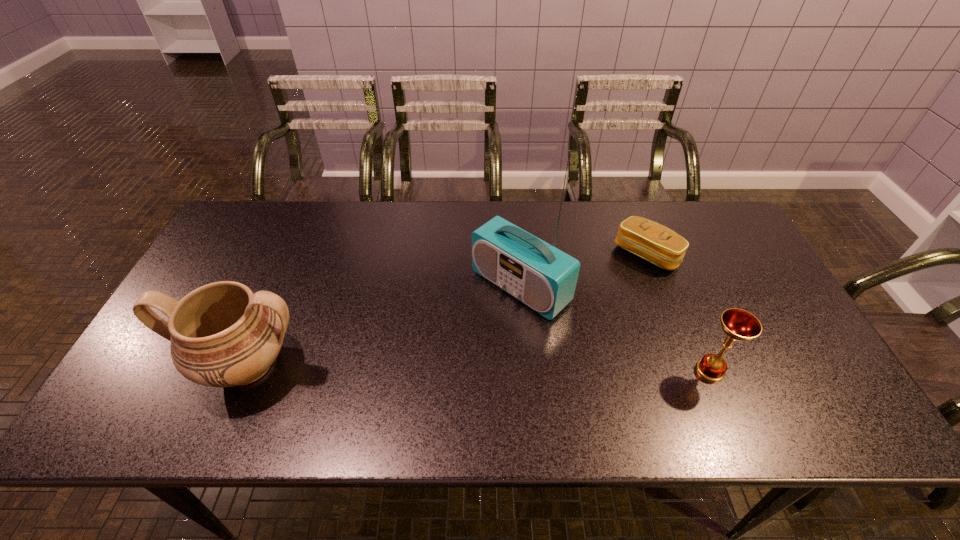
Identify the location of free area in between the clutch bag and the third shortest object. (446, 309).

You are a GUI agent. You are given a task and a screenshot of the screen. Output one action in this format:
    pyautogui.click(x=<x>, y=<y>)
    Task: Click on the vacant area that lies between the chalice and the radio receiver
    Image resolution: width=960 pixels, height=540 pixels.
    Given the screenshot: What is the action you would take?
    click(615, 328)

Find the location of a particular element. This screenshot has height=540, width=960. free spot between the tallest object and the clutch bag is located at coordinates (584, 270).

You are a GUI agent. You are given a task and a screenshot of the screen. Output one action in this format:
    pyautogui.click(x=<x>, y=<y>)
    Task: Click on the second closest object relative to the clutch bag
    Image resolution: width=960 pixels, height=540 pixels.
    Given the screenshot: What is the action you would take?
    pyautogui.click(x=739, y=325)

Point out which object is positioned as the second nearest to the shortest object. Please provide its 2D coordinates. Your answer should be formatted as a tuple, i.e. [(x, y)], where the tuple contains the x and y coordinates of a point satisfying the conditions above.

[(739, 325)]

This screenshot has width=960, height=540. In order to click on blank space that satisfies the following two spatial constraints: 1. on the front-facing side of the leftmost object; 2. on the left side of the chalice in this screenshot , I will do `click(245, 370)`.